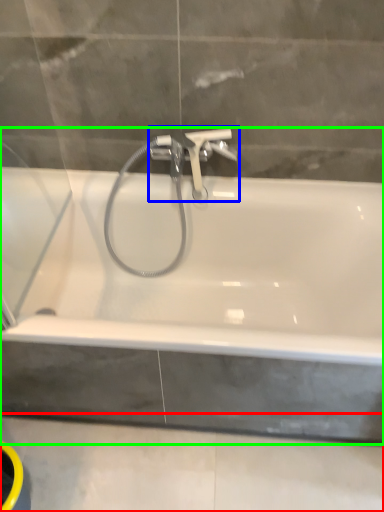
Question: Considering the real-world distances, which object is farthest from concrete (highlighted by a red box)? tap (highlighted by a blue box) or bathtub (highlighted by a green box)?

Choices:
 (A) tap
 (B) bathtub

Answer: (A)